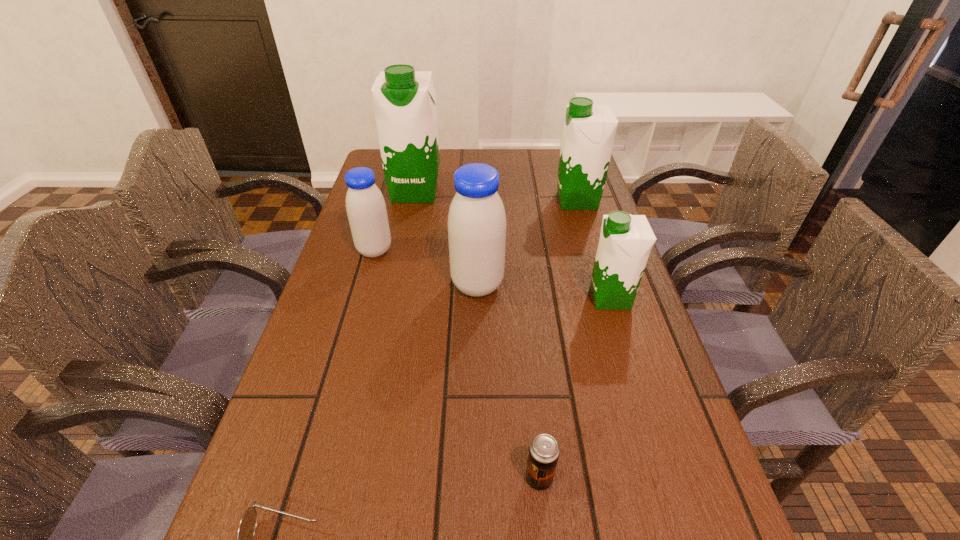
I want to click on the biggest green soya milk, so click(404, 100).

The height and width of the screenshot is (540, 960). Identify the location of the tallest object. (404, 100).

Find the location of a particular element. The image size is (960, 540). the second smallest green soya milk is located at coordinates (589, 130).

Locate an element on the screen. This screenshot has width=960, height=540. the right blue soya milk is located at coordinates (476, 221).

The width and height of the screenshot is (960, 540). In order to click on the fourth object from right to left in this screenshot , I will do `click(476, 221)`.

Find the location of a particular element. the nearest green soya milk is located at coordinates (626, 240).

You are a GUI agent. You are given a task and a screenshot of the screen. Output one action in this format:
    pyautogui.click(x=<x>, y=<y>)
    Task: Click on the farther blue soya milk
    This screenshot has height=540, width=960.
    Given the screenshot: What is the action you would take?
    pyautogui.click(x=365, y=205)

Locate an element on the screen. the left blue soya milk is located at coordinates (365, 205).

Identify the location of the sixth farthest object. (544, 450).

Where is `the third object from right to left`? This screenshot has height=540, width=960. the third object from right to left is located at coordinates (544, 450).